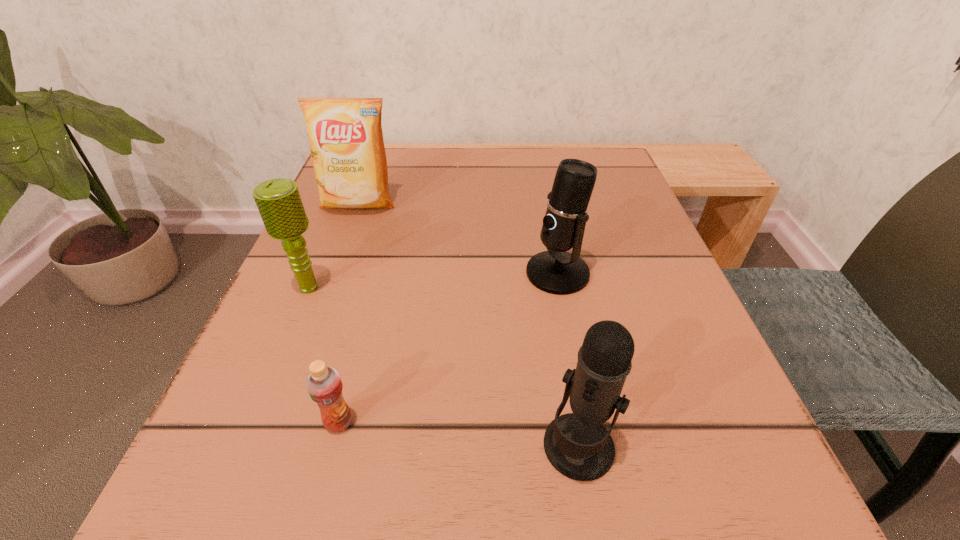
Identify the location of the farthest object. This screenshot has height=540, width=960. (345, 134).

Image resolution: width=960 pixels, height=540 pixels. I want to click on the nearest microphone, so click(x=577, y=445).

Identify the location of the leftmost microphone. The image size is (960, 540). (279, 202).

Where is `orange juice`? The height and width of the screenshot is (540, 960). orange juice is located at coordinates (324, 385).

Where is `free space located 0.360m on the front-facing side of the crisp (potato chip)`? free space located 0.360m on the front-facing side of the crisp (potato chip) is located at coordinates (295, 374).

The width and height of the screenshot is (960, 540). Find the location of `free region located on the back of the nearest microphone`. free region located on the back of the nearest microphone is located at coordinates (546, 260).

Find the location of `vacant region located 0.260m on the front of the leftmost microphone`. vacant region located 0.260m on the front of the leftmost microphone is located at coordinates (234, 469).

Find the location of a particular element. The width and height of the screenshot is (960, 540). free space located on the left of the shortest object is located at coordinates (256, 422).

The height and width of the screenshot is (540, 960). I want to click on object at the far edge, so click(345, 134).

Find the location of a particular element. object that is at the near edge is located at coordinates (577, 445).